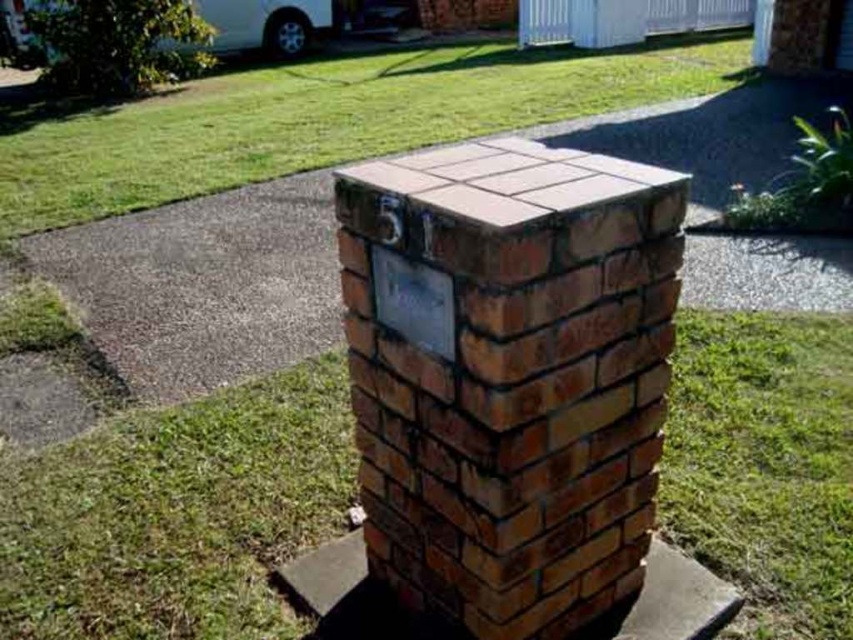
Is brown brick chimney at center positioned before green grass at lower right?

Yes.

Is point (598, 294) in front of point (780, 332)?

Yes, it is.

Image resolution: width=853 pixels, height=640 pixels. Identify the location of brown brick chimney at center. (509, 374).

Can you confirm if brown brick chimney at center is smaller than green grass at upper center?

Yes, brown brick chimney at center is smaller than green grass at upper center.

How distant is brown brick chimney at center from green grass at upper center?

The distance of brown brick chimney at center from green grass at upper center is 5.69 meters.

Identify the location of brown brick chimney at center. (509, 374).

You are a GUI agent. You are given a task and a screenshot of the screen. Output one action in this format:
    pyautogui.click(x=<x>, y=<y>)
    Task: Click on the brown brick chimney at center
    The width and height of the screenshot is (853, 640).
    Given the screenshot: What is the action you would take?
    pyautogui.click(x=509, y=374)

Which of these two, brown brick chimney at center or green grass at center, stands taller?

brown brick chimney at center is taller.

Describe the element at coordinates (509, 374) in the screenshot. I see `brown brick chimney at center` at that location.

Where is `brown brick chimney at center`? brown brick chimney at center is located at coordinates (509, 374).